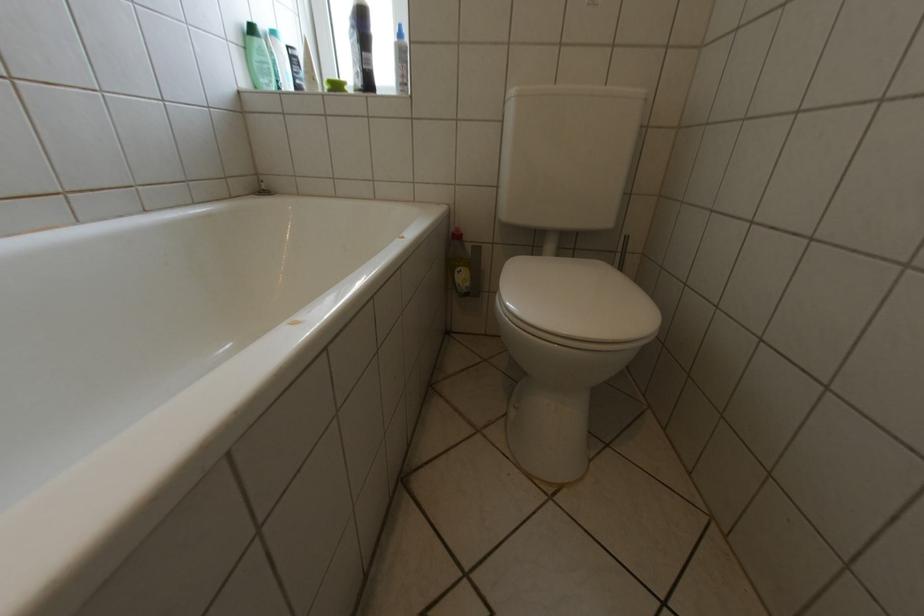
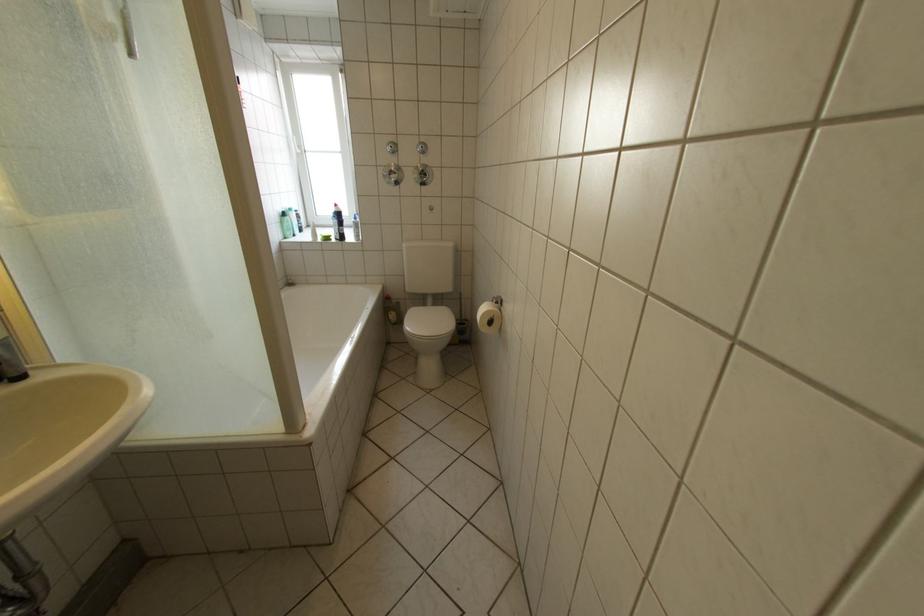
The point at (258, 50) is marked in the first image. Where is the corresponding point in the second image?

(294, 224)